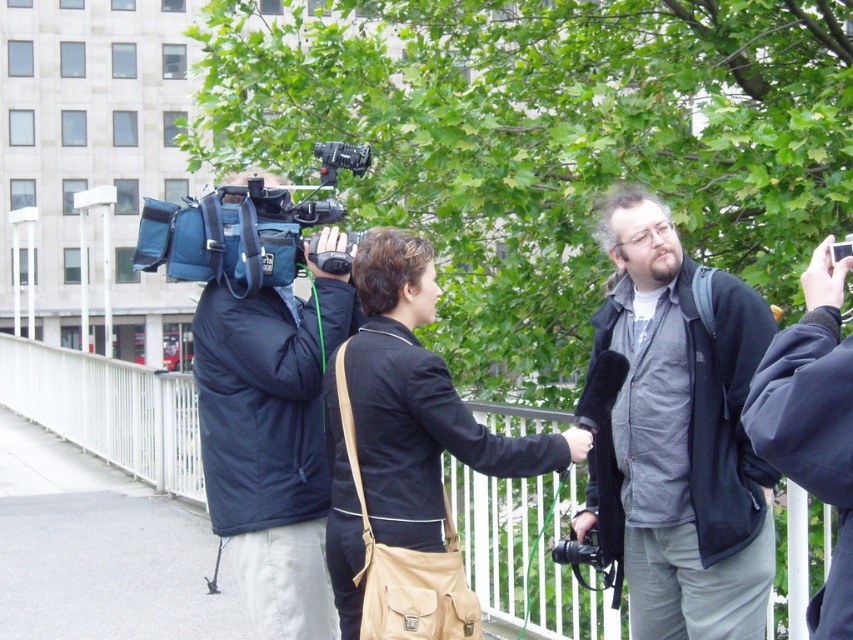
Question: Can you confirm if black puffy jacket at left is positioned below black leather jacket at center?

Choices:
 (A) no
 (B) yes

Answer: (A)

Question: Among these objects, which one is farthest from the camera?

Choices:
 (A) white metal fence at center
 (B) black leather jacket at center

Answer: (A)

Question: Estimate the real-world distances between objects in this image. Which object is closer to the black leather jacket at center?

Choices:
 (A) white metal fence at center
 (B) black puffy jacket at left

Answer: (B)

Question: Can you confirm if white metal fence at center is bigger than black puffy jacket at left?

Choices:
 (A) no
 (B) yes

Answer: (B)

Question: Which object is the farthest from the dark gray fleece jacket at center?

Choices:
 (A) black leather jacket at center
 (B) white metal fence at center
 (C) black puffy jacket at left

Answer: (B)

Question: From the image, what is the correct spatial relationship of white metal fence at center in relation to black puffy jacket at left?

Choices:
 (A) right
 (B) left

Answer: (B)